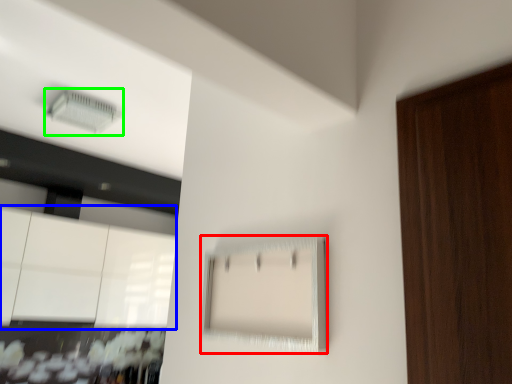
Question: Which object is the closest to the cabinetry (highlighted by a red box)? Choose among these: cabinetry (highlighted by a blue box) or air conditioning (highlighted by a green box).

Choices:
 (A) cabinetry
 (B) air conditioning

Answer: (B)